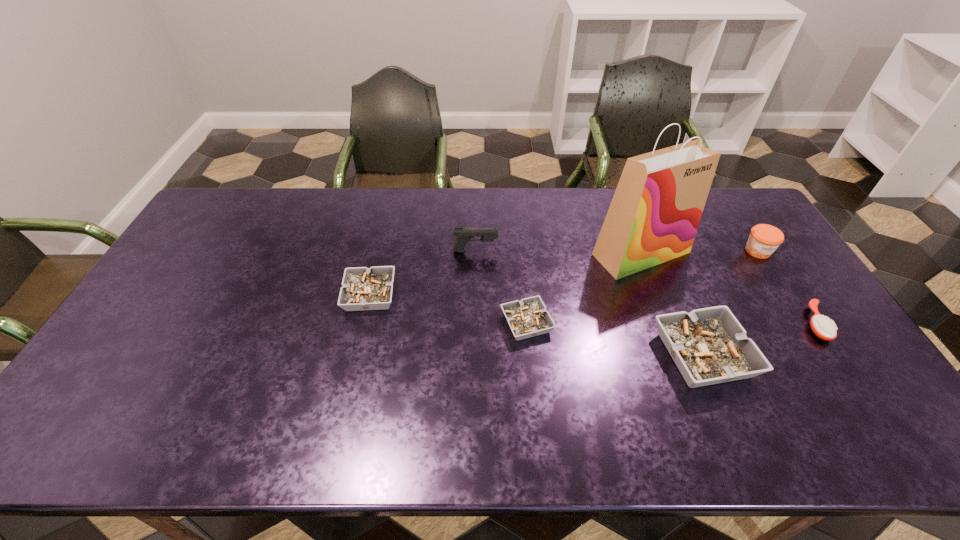
Please point a spot to add another ashtray on the left. Please provide its 2D coordinates. Your answer should be formatted as a tuple, i.e. [(x, y)], where the tuple contains the x and y coordinates of a point satisfying the conditions above.

[(230, 269)]